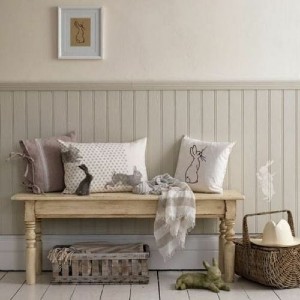
You are a GUI agent. You are given a task and a screenshot of the screen. Output one action in this format:
    pyautogui.click(x=<x>, y=<y>)
    Task: Click on the white pillow with bunny embroidary
    Image resolution: width=300 pixels, height=300 pixels.
    Given the screenshot: What is the action you would take?
    pyautogui.click(x=206, y=180)